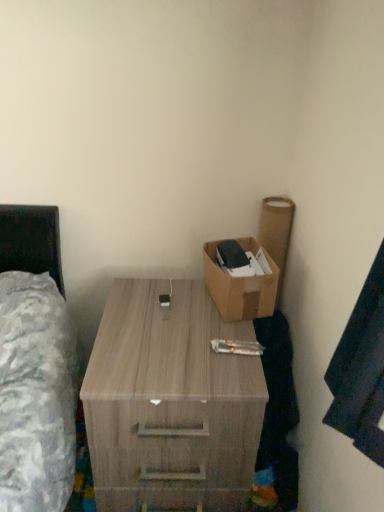
At what (x,y) coordinates should I click in order to perform the action: click on free location to the left of brown cardboard box at upper right. Please return your answer as a coordinate pair (x, y). Looking at the image, I should click on (166, 302).